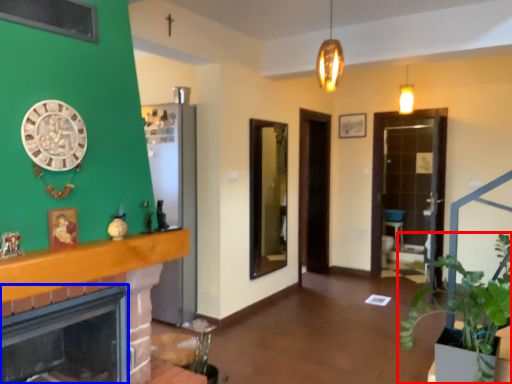
Question: Which point is closer to the camera, houseplant (highlighted by a red box) or fireplace (highlighted by a blue box)?

Choices:
 (A) houseplant
 (B) fireplace

Answer: (B)